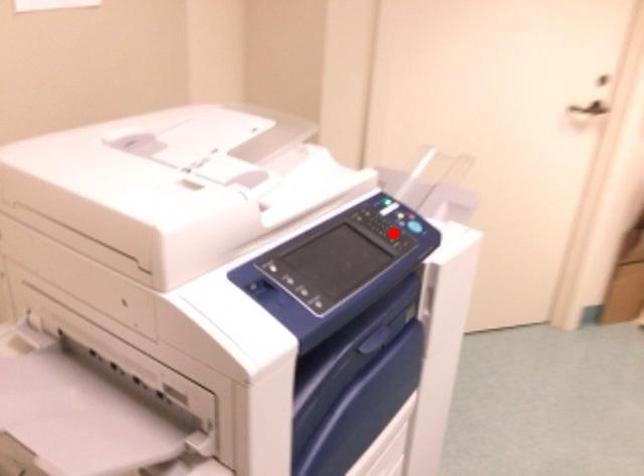
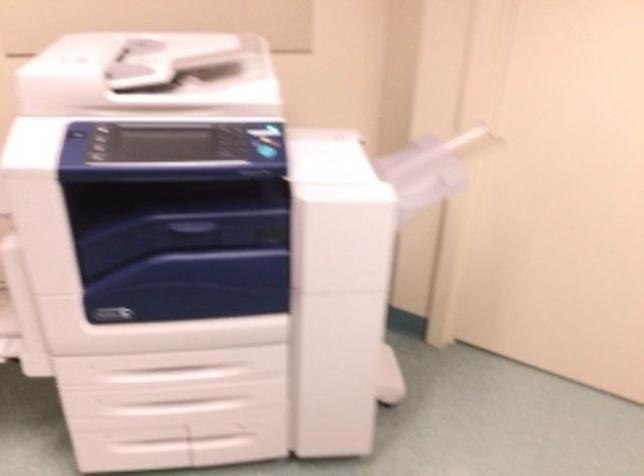
Question: I am providing you with two images of the same scene from different viewpoints. In image1, a red point is highlighted. Considering the same 3D point in image2, which of the following is correct?

Choices:
 (A) It is closer
 (B) It is farther

Answer: (B)